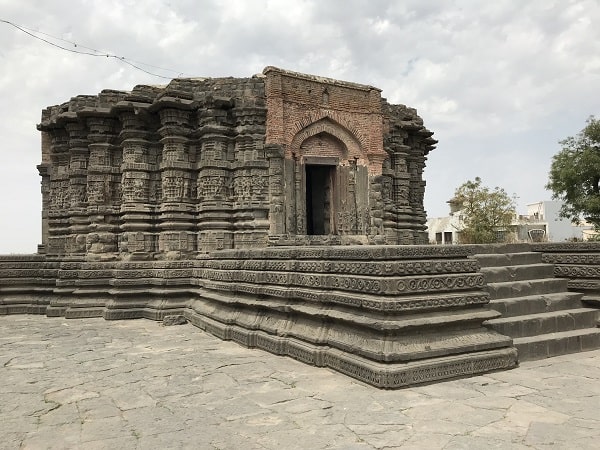
You are a GUI agent. You are given a task and a screenshot of the screen. Output one action in this format:
    pyautogui.click(x=<x>, y=<y>)
    Task: Click on the stairs
    The image size is (600, 450).
    Given the screenshot: What is the action you would take?
    pyautogui.click(x=499, y=247), pyautogui.click(x=501, y=256), pyautogui.click(x=512, y=270), pyautogui.click(x=525, y=285), pyautogui.click(x=533, y=304), pyautogui.click(x=547, y=322), pyautogui.click(x=558, y=346)